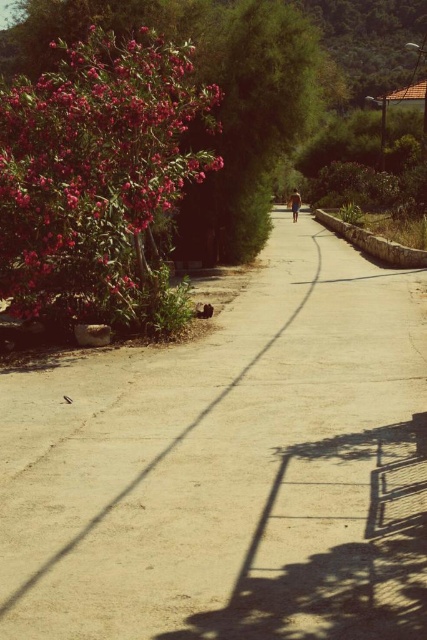
In the scene shown: You are standing at the beginning of the pathway and want to take a photo that includes both the vibrant pink flower bush on the left and the low stone on the right. Which point, point (x=389, y=515) or point (x=84, y=163), is closer to your camera when capturing this scene?

Point (x=389, y=515) is closer to the camera than point (x=84, y=163).

You are a gardener who wants to plant more flowers along the pathway. You have a new batch of flowers that are the same size as the blue denim shorts at center. Can the space where the matte pink flowers at left currently occupy accommodate these new flowers without overcrowding?

The matte pink flowers at left are narrower than the blue denim shorts at center. Since the new flowers are the same size as the blue denim shorts at center, which are wider, the space currently occupied by the matte pink flowers at left is insufficient to accommodate the new flowers without overcrowding.